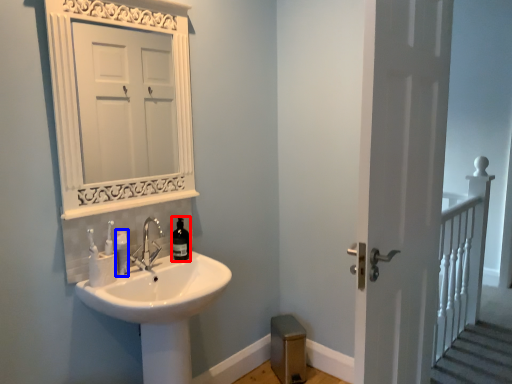
Question: Which point is closer to the camera, bottle (highlighted by a red box) or toiletry (highlighted by a blue box)?

Choices:
 (A) bottle
 (B) toiletry

Answer: (B)